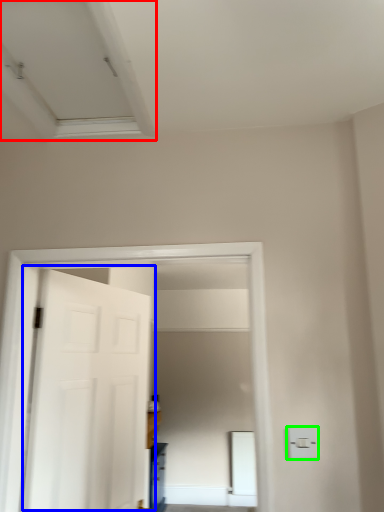
Question: Which is nearer to the exhaust hood (highlighted by a red box)? door (highlighted by a blue box) or light switch (highlighted by a green box).

Choices:
 (A) door
 (B) light switch

Answer: (A)